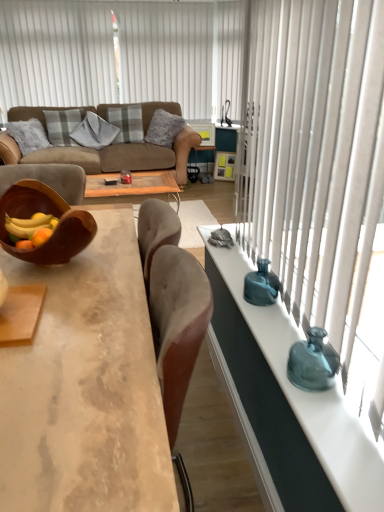
Find the location of `free space to the back side of teal glass vase at right, placed as the 2th vase when sorted from top to bottom`. free space to the back side of teal glass vase at right, placed as the 2th vase when sorted from top to bottom is located at coordinates (281, 339).